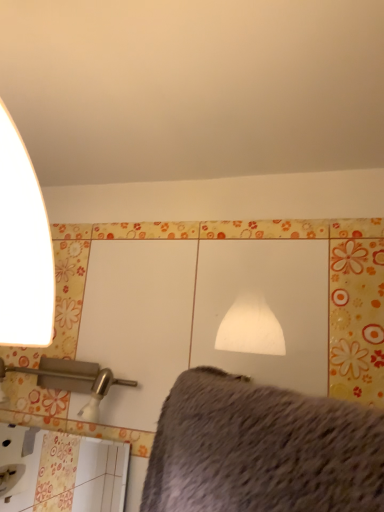
This screenshot has height=512, width=384. Describe the element at coordinates (72, 380) in the screenshot. I see `brushed metal shower at lower left` at that location.

Find the location of a particular element. This screenshot has height=512, width=384. brushed metal shower at lower left is located at coordinates (72, 380).

What is the approximate width of brushed metal shower at lower left?

It is 5.31 inches.

Where is `brushed metal shower at lower left`? This screenshot has height=512, width=384. brushed metal shower at lower left is located at coordinates (72, 380).